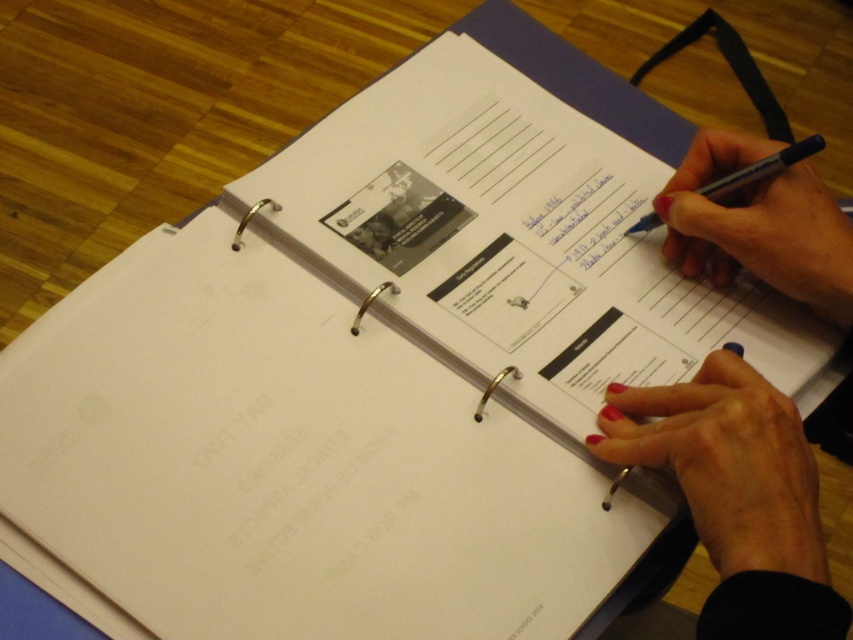
You are an artist trying to sketch the scene. You need to ensure that the proportions between the smooth skin hand at upper right and the black pen at upper right are accurate. Which object should you draw larger in your sketch?

The smooth skin hand at upper right should be drawn larger than the black pen at upper right because the description states that the smooth skin hand at upper right is much taller as black pen at upper right.

You are a robotic arm trying to place a pen on the desk. The desk is at the bottom of the image. The robotic arm is currently at position point 0.5,0.5. Which direction should the robotic arm move to reach the smooth skin hand at upper right?

The robotic arm should move upwards and to the right because the smooth skin hand at upper right is located at position point (735, 493), which is higher and to the right of the robotic arm at (426, 320).